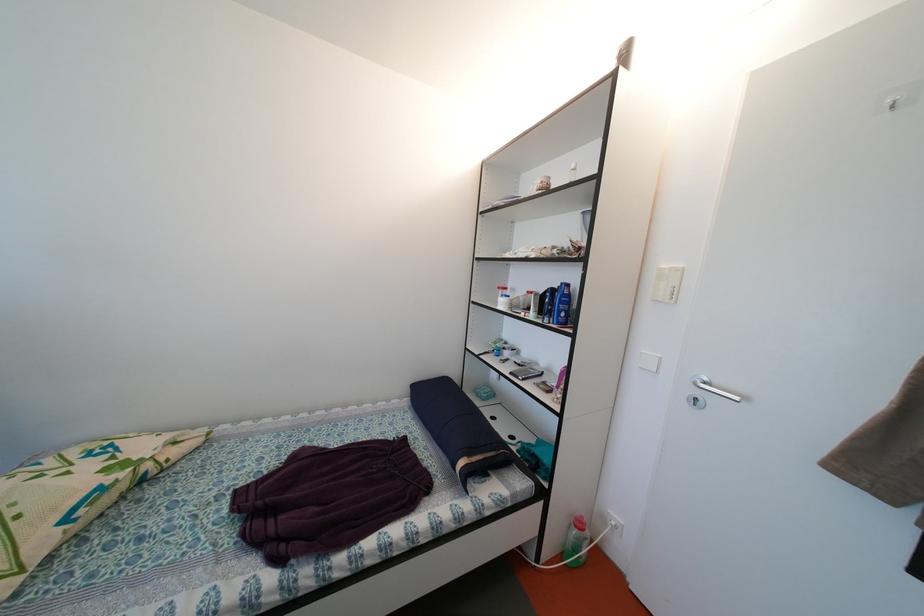
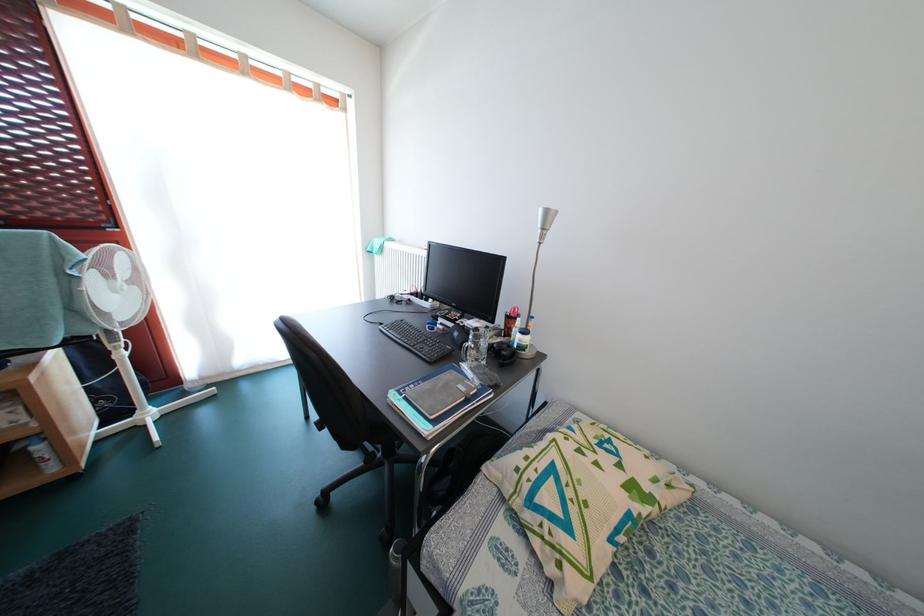
Question: The images are taken continuously from a first-person perspective. In which direction is your viewpoint rotating?

Choices:
 (A) Left
 (B) Right
 (C) Up
 (D) Down

Answer: (A)